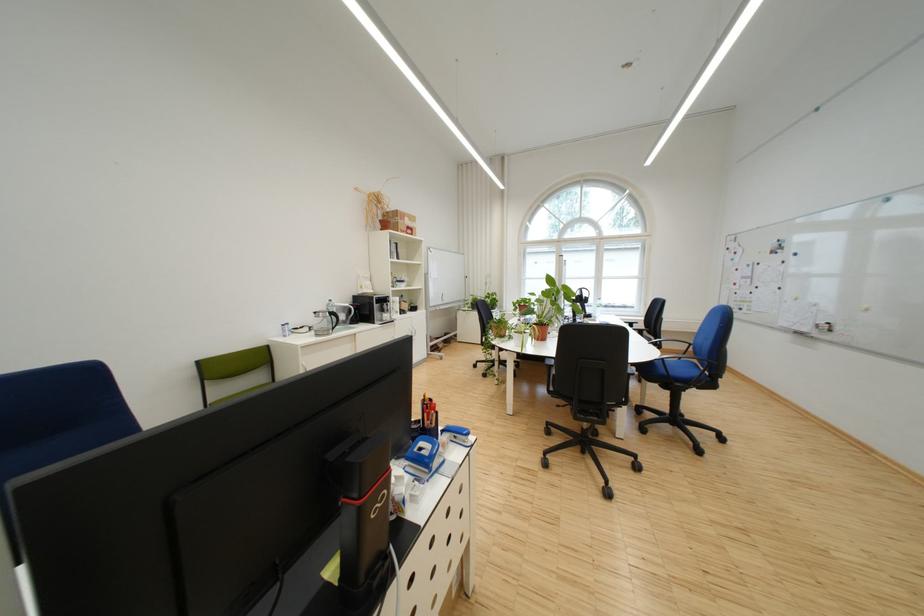
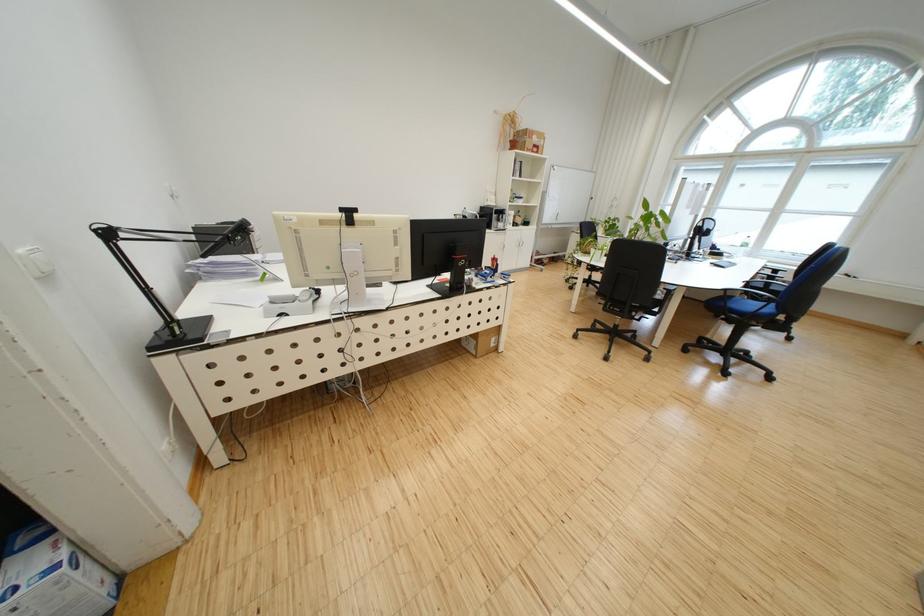
The point at (509, 341) is marked in the first image. Where is the corresponding point in the second image?

(592, 256)